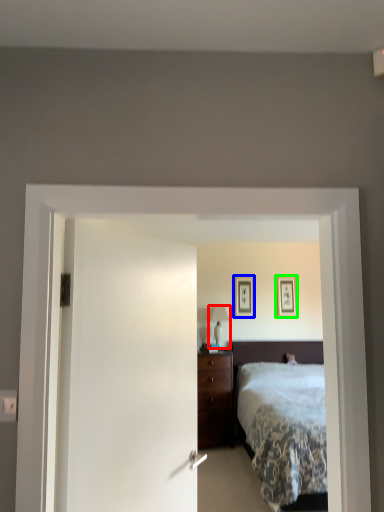
Question: Which is nearer to the table lamp (highlighted by a red box)? picture frame (highlighted by a blue box) or picture frame (highlighted by a green box).

Choices:
 (A) picture frame
 (B) picture frame

Answer: (A)